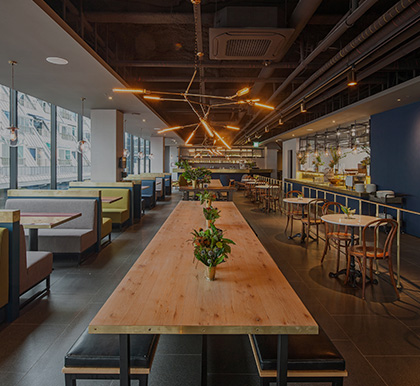
This screenshot has width=420, height=386. I want to click on restaurant booths, so click(34, 264), click(3, 251), click(76, 231), click(105, 223), click(119, 214), click(139, 207), click(149, 194), click(161, 191), click(157, 197), click(168, 188).